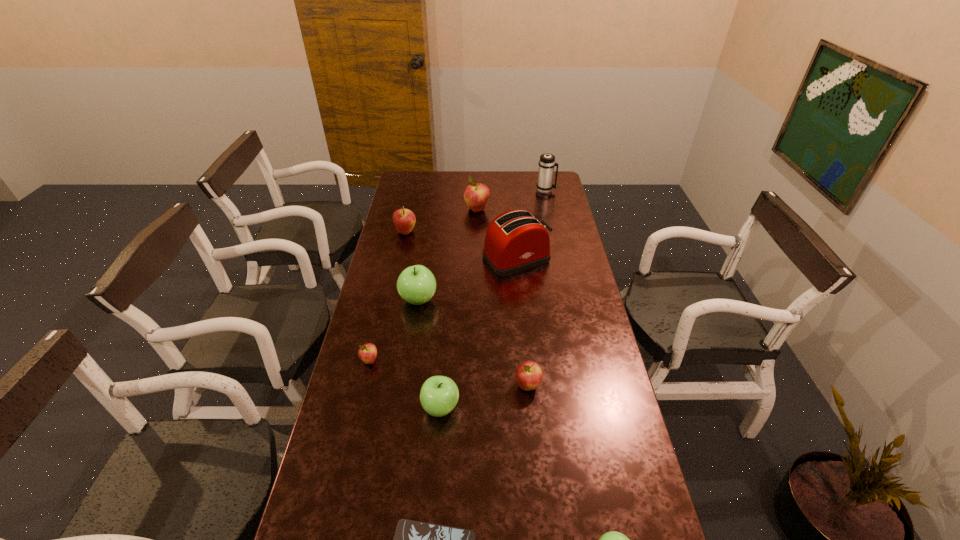
Locate an element on the screen. The image size is (960, 540). vacant space located 0.160m on the right of the sixth farthest object is located at coordinates (428, 361).

What are the coordinates of `object positioned at the far edge` in the screenshot? It's located at (547, 163).

Where is `toaster at the right edge`? This screenshot has width=960, height=540. toaster at the right edge is located at coordinates (515, 241).

The width and height of the screenshot is (960, 540). I want to click on thermos bottle located at the right edge, so click(x=547, y=163).

Identify the location of object that is at the far right corner. (547, 163).

The image size is (960, 540). What are the coordinates of `vacant region at the left edge` in the screenshot? It's located at (375, 287).

The image size is (960, 540). I want to click on vacant space at the right edge of the desktop, so click(606, 416).

In the image, there is a desktop. Where is `free space at the far left corner`? This screenshot has height=540, width=960. free space at the far left corner is located at coordinates (397, 190).

This screenshot has height=540, width=960. What are the coordinates of `blank region between the third smallest red apple and the fifth farthest object` in the screenshot? It's located at (412, 266).

Find the location of `free space that is in between the third farthest object and the fifth nearest apple`. free space that is in between the third farthest object and the fifth nearest apple is located at coordinates (412, 266).